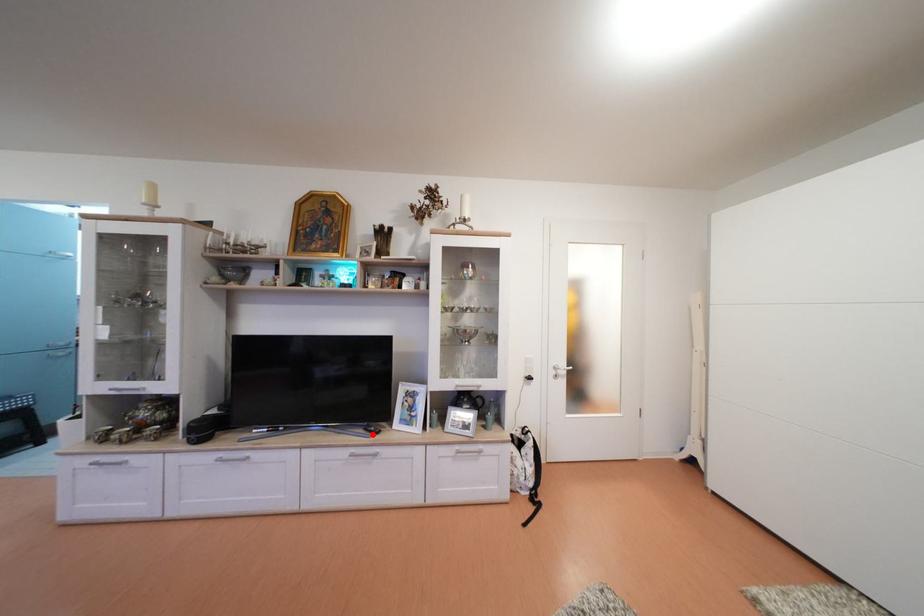
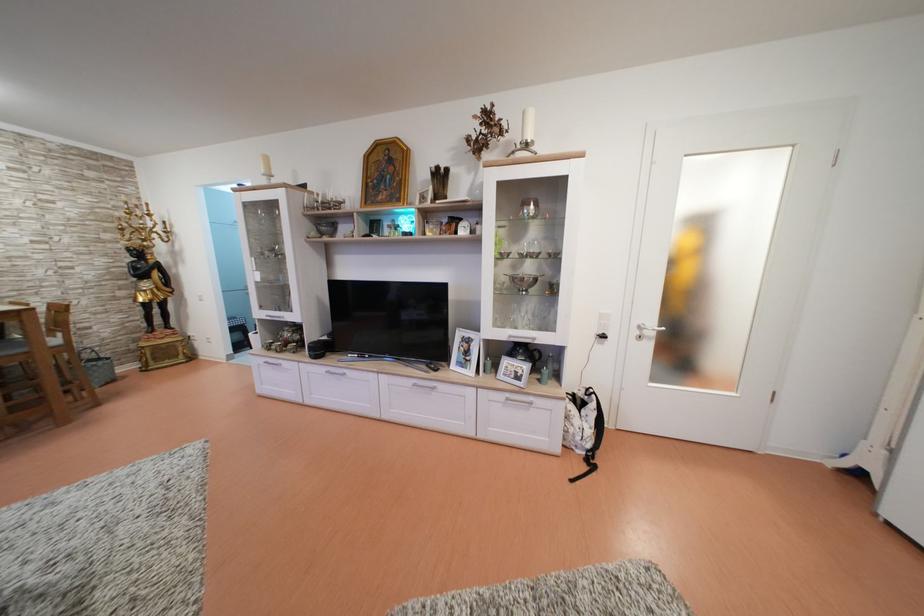
Locate, in the second image, the point that corresponds to the highlighted location in the first image.

(434, 371)